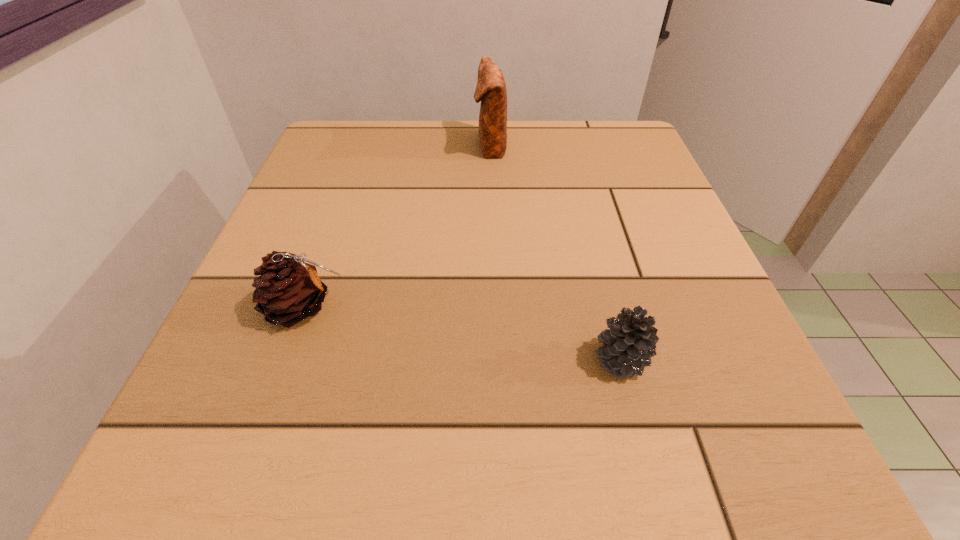
This screenshot has height=540, width=960. In the image, there is a desktop. Identify the location of vacant space at the near right corner. (683, 476).

Image resolution: width=960 pixels, height=540 pixels. In order to click on empty space that is in between the tallest object and the nearest object in this screenshot , I will do `click(555, 253)`.

This screenshot has width=960, height=540. In order to click on vacant region between the farthest object and the rightmost object in this screenshot , I will do `click(555, 253)`.

Find the location of `vacant space that is in between the farthest object and the rightmost object`. vacant space that is in between the farthest object and the rightmost object is located at coordinates (555, 253).

I want to click on free space between the farthest object and the nearest object, so coord(555,253).

You are a GUI agent. You are given a task and a screenshot of the screen. Output one action in this format:
    pyautogui.click(x=<x>, y=<y>)
    Task: Click on the vacant area that lies between the farthest object and the nearest object
    This screenshot has width=960, height=540.
    Given the screenshot: What is the action you would take?
    pyautogui.click(x=555, y=253)

Locate an element on the screen. This screenshot has height=540, width=960. empty space that is in between the tallest object and the rightmost object is located at coordinates (555, 253).

Locate an element on the screen. free space between the nearest object and the second nearest object is located at coordinates (462, 333).

The image size is (960, 540). I want to click on free space between the farther pinecone and the second object from right to left, so click(397, 227).

This screenshot has height=540, width=960. I want to click on free spot between the tallest object and the second farthest object, so click(x=397, y=227).